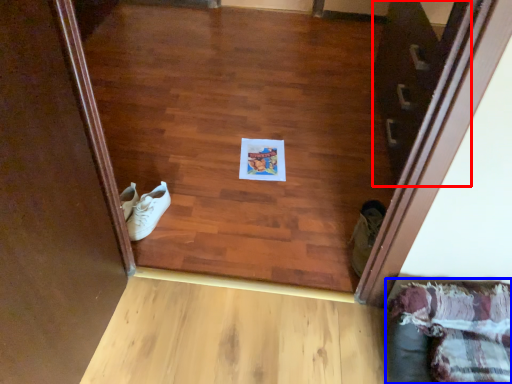
Question: Which point is closer to the camera, stairwell (highlighted by a red box) or couch (highlighted by a blue box)?

Choices:
 (A) stairwell
 (B) couch

Answer: (B)